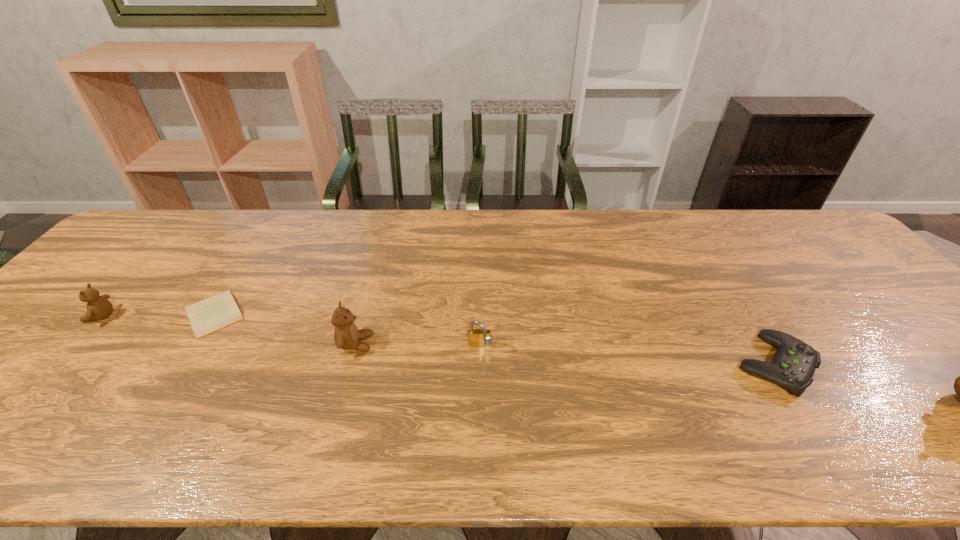
Identify the location of the leftmost object. The height and width of the screenshot is (540, 960). (98, 307).

Identify the location of the shorter teddy bear. The width and height of the screenshot is (960, 540). (98, 307).

This screenshot has width=960, height=540. Find the location of `the right teddy bear`. the right teddy bear is located at coordinates (346, 335).

Identify the location of the tallest object. This screenshot has height=540, width=960. (346, 335).

At what (x,y) coordinates should I click in order to perform the action: click on padlock. Please return your answer as a coordinate pair (x, y). The width and height of the screenshot is (960, 540). Looking at the image, I should click on (479, 338).

Locate an element on the screen. The image size is (960, 540). the fourth tallest object is located at coordinates (793, 365).

I want to click on the rightmost object, so click(793, 365).

This screenshot has height=540, width=960. I want to click on the shortest object, so [x=217, y=312].

The width and height of the screenshot is (960, 540). I want to click on diary, so click(x=217, y=312).

This screenshot has height=540, width=960. What are the coordinates of `vacant space located 0.080m on the front-facing side of the left teddy bear` in the screenshot? It's located at (57, 316).